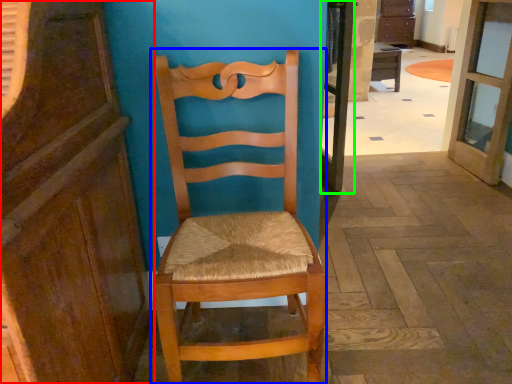
Question: Based on their relative distances, which object is farther from cabinetry (highlighted by a red box)? Choose from chair (highlighted by a blue box) and screen door (highlighted by a green box).

Choices:
 (A) chair
 (B) screen door

Answer: (B)